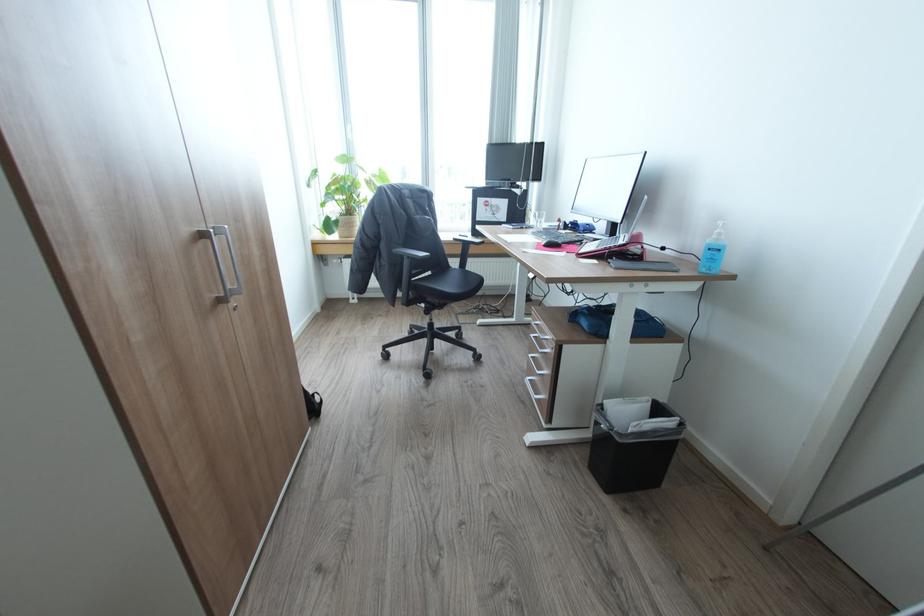
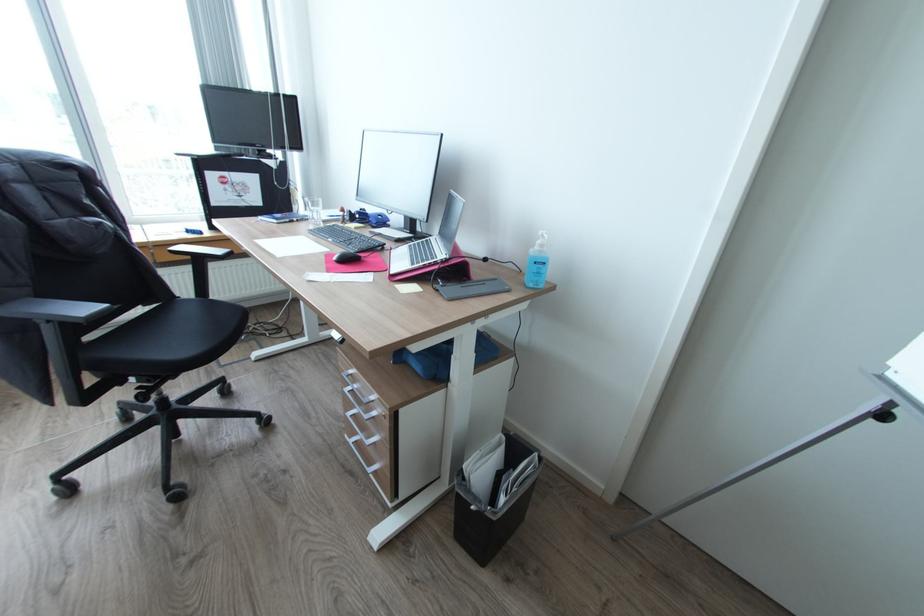
The point at (543, 370) is marked in the first image. Where is the corresponding point in the second image?

(372, 438)